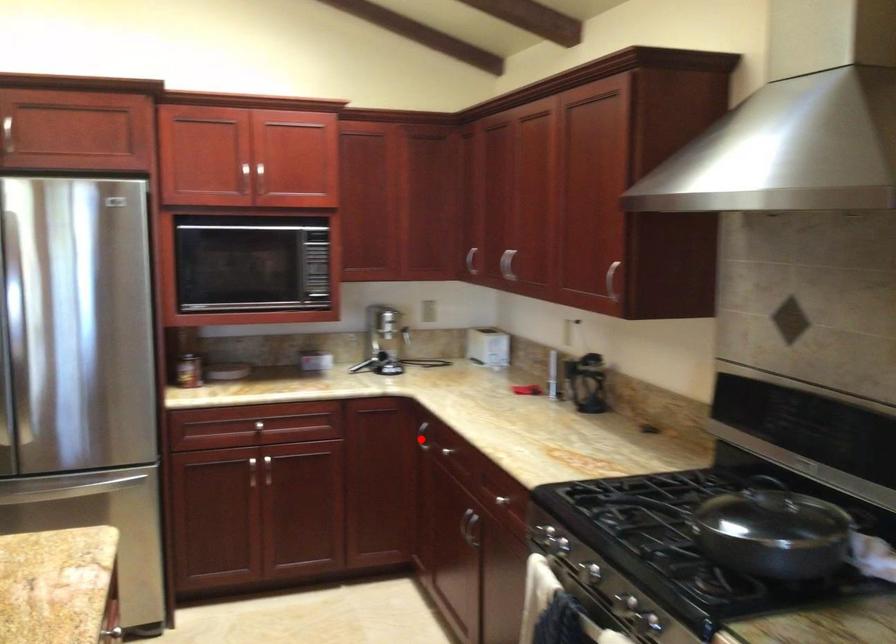
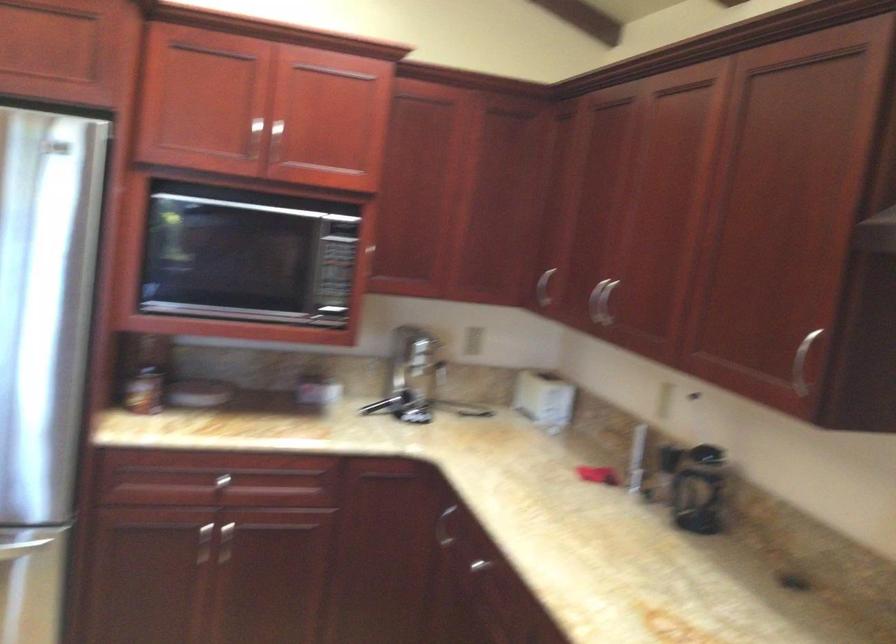
Question: A red point is marked in image1. In image2, is the corresponding 3D point closer to the camera or farther? Reply with the corresponding letter.

Choices:
 (A) The corresponding 3D point is closer.
 (B) The corresponding 3D point is farther.

Answer: (A)